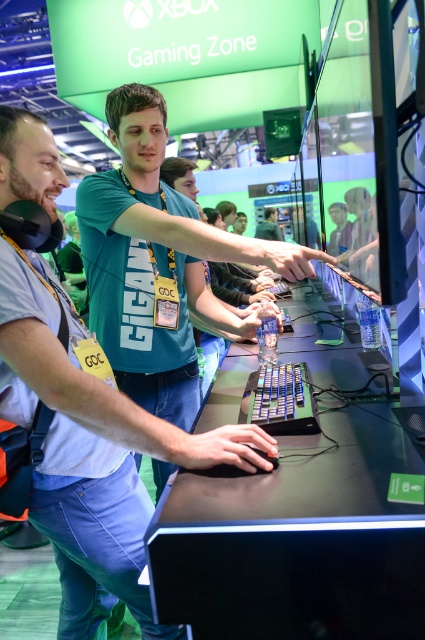
Question: Which of the following is the closest to the observer?

Choices:
 (A) tap(336, 253)
 (B) tap(283, 428)

Answer: (B)

Question: Is black plastic keyboard at center wider than matte green shirt at center?

Choices:
 (A) yes
 (B) no

Answer: (A)

Question: Among these points, which one is farthest from the camera?

Choices:
 (A) (280, 397)
 (B) (334, 252)

Answer: (B)

Question: Can you confirm if black plastic keyboard at center is bigger than matte green shirt at center?

Choices:
 (A) yes
 (B) no

Answer: (A)

Question: Does black plastic keyboard at center have a larger size compared to matte green shirt at center?

Choices:
 (A) no
 (B) yes

Answer: (B)

Question: Which object is closer to the camera taking this photo?

Choices:
 (A) black plastic keyboard at center
 (B) matte green shirt at center

Answer: (A)